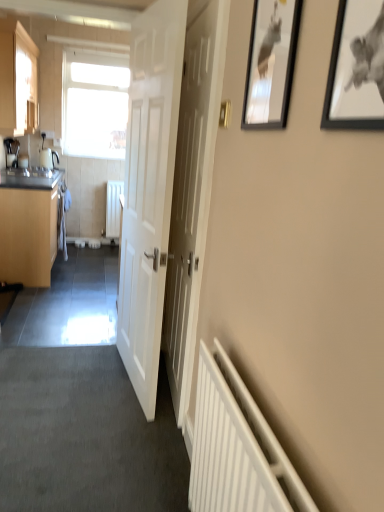
The height and width of the screenshot is (512, 384). What do you see at coordinates (30, 172) in the screenshot? I see `matte silver sink at left` at bounding box center [30, 172].

The image size is (384, 512). Describe the element at coordinates (28, 226) in the screenshot. I see `matte wood cabinet at left, which is counted as the second cabinetry, starting from the top` at that location.

Image resolution: width=384 pixels, height=512 pixels. What are the coordinates of `matte wood cabinet at upper left, which is counted as the first cabinetry, starting from the top` in the screenshot? It's located at (18, 80).

The width and height of the screenshot is (384, 512). What do you see at coordinates (237, 448) in the screenshot?
I see `white matte radiator at lower right, positioned as the first radiator in right-to-left order` at bounding box center [237, 448].

What are the coordinates of `matte silver sink at left` in the screenshot? It's located at (30, 172).

Is matte wood cabinet at left, which is the first cabinetry in bottom-to-top order, looking in the opposite direction of matte wood cabinet at upper left, the second cabinetry when ordered from bottom to top?

No, matte wood cabinet at left, which is the first cabinetry in bottom-to-top order, is not facing away from matte wood cabinet at upper left, the second cabinetry when ordered from bottom to top.

From a real-world perspective, who is located lower, matte wood cabinet at left, which is the first cabinetry in bottom-to-top order, or matte wood cabinet at upper left, the second cabinetry when ordered from bottom to top?

matte wood cabinet at left, which is the first cabinetry in bottom-to-top order.

Would you consider matte wood cabinet at left, which is counted as the second cabinetry, starting from the top, to be distant from matte wood cabinet at upper left, the second cabinetry when ordered from bottom to top?

No, matte wood cabinet at left, which is counted as the second cabinetry, starting from the top, is in close proximity to matte wood cabinet at upper left, the second cabinetry when ordered from bottom to top.

In the scene shown: Is black glossy picture frame at upper right, the second picture frame in the right-to-left sequence, situated inside white matte radiator at lower right, acting as the second radiator starting from the top, or outside?

black glossy picture frame at upper right, the second picture frame in the right-to-left sequence, cannot be found inside white matte radiator at lower right, acting as the second radiator starting from the top.

From the picture: From the image's perspective, is black glossy picture frame at upper right, the 1th picture frame positioned from the left, under white matte radiator at lower right, acting as the second radiator starting from the top?

No, from the image's perspective, black glossy picture frame at upper right, the 1th picture frame positioned from the left, is not beneath white matte radiator at lower right, acting as the second radiator starting from the top.

Would you say black glossy picture frame at upper right, the second picture frame in the right-to-left sequence, is a long distance from white matte radiator at lower right, positioned as the first radiator in right-to-left order?

black glossy picture frame at upper right, the second picture frame in the right-to-left sequence, is near white matte radiator at lower right, positioned as the first radiator in right-to-left order, not far away.

Is black glossy picture frame at upper right, the 1th picture frame positioned from the left, to the right of white matte radiator at lower right, marked as the 1th radiator in a bottom-to-top arrangement, from the viewer's perspective?

Indeed, black glossy picture frame at upper right, the 1th picture frame positioned from the left, is positioned on the right side of white matte radiator at lower right, marked as the 1th radiator in a bottom-to-top arrangement.

Image resolution: width=384 pixels, height=512 pixels. In order to click on door below the white wooden door at center, which is the first door from left to right (from the image's perspective) in this screenshot , I will do `click(192, 186)`.

In the scene shown: Is white wooden door at center, placed as the 1th door when sorted from right to left, oriented away from white wooden door at center, marked as the second door in a right-to-left arrangement?

No.

Is white wooden door at center, the second door from the left, positioned far away from white wooden door at center, marked as the second door in a right-to-left arrangement?

Actually, white wooden door at center, the second door from the left, and white wooden door at center, marked as the second door in a right-to-left arrangement, are a little close together.

Is point (44, 169) closer to camera compared to point (39, 245)?

No, it is not.

Could you tell me if matte silver sink at left is turned towards matte wood cabinet at left, which is counted as the second cabinetry, starting from the top?

No, matte silver sink at left does not turn towards matte wood cabinet at left, which is counted as the second cabinetry, starting from the top.

From a real-world perspective, does matte silver sink at left stand above matte wood cabinet at left, which is the first cabinetry in bottom-to-top order?

Correct, in the physical world, matte silver sink at left is higher than matte wood cabinet at left, which is the first cabinetry in bottom-to-top order.

Which is nearer, (215, 3) or (11, 144)?

The point (215, 3) is in front.

Considering the relative positions of white wooden door at center, the second door from the left, and metallic silver kettle at left in the image provided, is white wooden door at center, the second door from the left, to the left of metallic silver kettle at left from the viewer's perspective?

Incorrect, white wooden door at center, the second door from the left, is not on the left side of metallic silver kettle at left.

Who is bigger, white wooden door at center, placed as the 1th door when sorted from right to left, or metallic silver kettle at left?

With larger size is white wooden door at center, placed as the 1th door when sorted from right to left.

Which is closer to the camera, (113, 200) or (59, 228)?

The point (59, 228) is in front.

Who is taller, white matte radiator at center, which is the 1th radiator from top to bottom, or white fabric laundry at left?

With more height is white fabric laundry at left.

Is white matte radiator at center, the 1th radiator positioned from the left, bigger or smaller than white fabric laundry at left?

Considering their sizes, white matte radiator at center, the 1th radiator positioned from the left, takes up more space than white fabric laundry at left.

Is white matte radiator at center, positioned as the 1th radiator in back-to-front order, at the right side of white fabric laundry at left?

Correct, you'll find white matte radiator at center, positioned as the 1th radiator in back-to-front order, to the right of white fabric laundry at left.

From the image's perspective, is white matte radiator at center, positioned as the 1th radiator in back-to-front order, above matte wood cabinet at left, which is counted as the second cabinetry, starting from the top?

Correct, white matte radiator at center, positioned as the 1th radiator in back-to-front order, appears higher than matte wood cabinet at left, which is counted as the second cabinetry, starting from the top, in the image.

Considering the sizes of white matte radiator at center, the 1th radiator positioned from the left, and matte wood cabinet at left, which is the first cabinetry in bottom-to-top order, in the image, is white matte radiator at center, the 1th radiator positioned from the left, taller or shorter than matte wood cabinet at left, which is the first cabinetry in bottom-to-top order,?

In the image, white matte radiator at center, the 1th radiator positioned from the left, appears to be shorter than matte wood cabinet at left, which is the first cabinetry in bottom-to-top order.

In terms of size, does white matte radiator at center, which is the 1th radiator from top to bottom, appear bigger or smaller than matte wood cabinet at left, which is counted as the second cabinetry, starting from the top?

In the image, white matte radiator at center, which is the 1th radiator from top to bottom, appears to be smaller than matte wood cabinet at left, which is counted as the second cabinetry, starting from the top.

Does point (116, 182) lie in front of point (11, 271)?

No, it is not.

Find the location of a particular element. This screenshot has width=384, height=512. cabinetry that appears below the matte wood cabinet at upper left, which is counted as the first cabinetry, starting from the top (from the image's perspective) is located at coordinates (28, 226).

Starting from the white matte radiator at lower right, acting as the second radiator starting from the top, which picture frame is the 1st one to the right? Please provide its 2D coordinates.

[(270, 63)]

Estimate the real-world distances between objects in this image. Which object is closer to white wooden door at center, marked as the second door in a right-to-left arrangement, white matte radiator at lower right, the first radiator in the front-to-back sequence, or black matte picture frame at upper right, positioned as the first picture frame in right-to-left order?

Among the two, white matte radiator at lower right, the first radiator in the front-to-back sequence, is located nearer to white wooden door at center, marked as the second door in a right-to-left arrangement.

Based on the photo, when comparing their distances from white matte radiator at center, the 2th radiator when ordered from bottom to top, does white wooden door at center, placed as the 1th door when sorted from right to left, or metallic silver kettle at left seem closer?

The object closer to white matte radiator at center, the 2th radiator when ordered from bottom to top, is metallic silver kettle at left.

When comparing their distances from metallic silver kettle at left, does white wooden door at center, marked as the second door in a right-to-left arrangement, or matte wood cabinet at left, which is the first cabinetry in bottom-to-top order, seem further?

The object further to metallic silver kettle at left is white wooden door at center, marked as the second door in a right-to-left arrangement.

Estimate the real-world distances between objects in this image. Which object is further from white matte radiator at center, the 2th radiator when ordered from bottom to top, transparent glass window at upper left or white matte radiator at lower right, the 2th radiator in the back-to-front sequence?

white matte radiator at lower right, the 2th radiator in the back-to-front sequence.

In the scene shown: Looking at the image, which one is located closer to white wooden door at center, marked as the second door in a right-to-left arrangement, black matte picture frame at upper right, the 2th picture frame viewed from the back, or matte silver sink at left?

Among the two, black matte picture frame at upper right, the 2th picture frame viewed from the back, is located nearer to white wooden door at center, marked as the second door in a right-to-left arrangement.

When comparing their distances from black glossy picture frame at upper right, which appears as the first picture frame when viewed from the back, does black matte picture frame at upper right, the 2th picture frame viewed from the back, or white matte radiator at lower right, acting as the second radiator starting from the top, seem further?

Among the two, white matte radiator at lower right, acting as the second radiator starting from the top, is located further to black glossy picture frame at upper right, which appears as the first picture frame when viewed from the back.

From the picture: From the image, which object appears to be nearer to white matte radiator at center, the 2th radiator when ordered from bottom to top, transparent glass window at upper left or white fabric laundry at left?

The object closer to white matte radiator at center, the 2th radiator when ordered from bottom to top, is white fabric laundry at left.

Based on the photo, from the image, which object appears to be nearer to white matte radiator at lower right, marked as the 1th radiator in a bottom-to-top arrangement, matte silver sink at left or white wooden door at center, marked as the second door in a right-to-left arrangement?

Among the two, white wooden door at center, marked as the second door in a right-to-left arrangement, is located nearer to white matte radiator at lower right, marked as the 1th radiator in a bottom-to-top arrangement.

At what (x,y) coordinates should I click in order to perform the action: click on window positioned between black matte picture frame at upper right, the 2th picture frame from the left, and white matte radiator at center, which is the 1th radiator from top to bottom, from near to far. Please return your answer as a coordinate pair (x, y). The image size is (384, 512). Looking at the image, I should click on (x=94, y=106).

Locate an element on the screen. Image resolution: width=384 pixels, height=512 pixels. appliance between matte wood cabinet at left, which is the first cabinetry in bottom-to-top order, and transparent glass window at upper left, along the z-axis is located at coordinates (11, 152).

Find the location of a particular element. radiator between transparent glass window at upper left and white fabric laundry at left in the up-down direction is located at coordinates (113, 208).

I want to click on door between white wooden door at center, marked as the second door in a right-to-left arrangement, and white matte radiator at lower right, marked as the 1th radiator in a bottom-to-top arrangement, in the vertical direction, so click(192, 186).